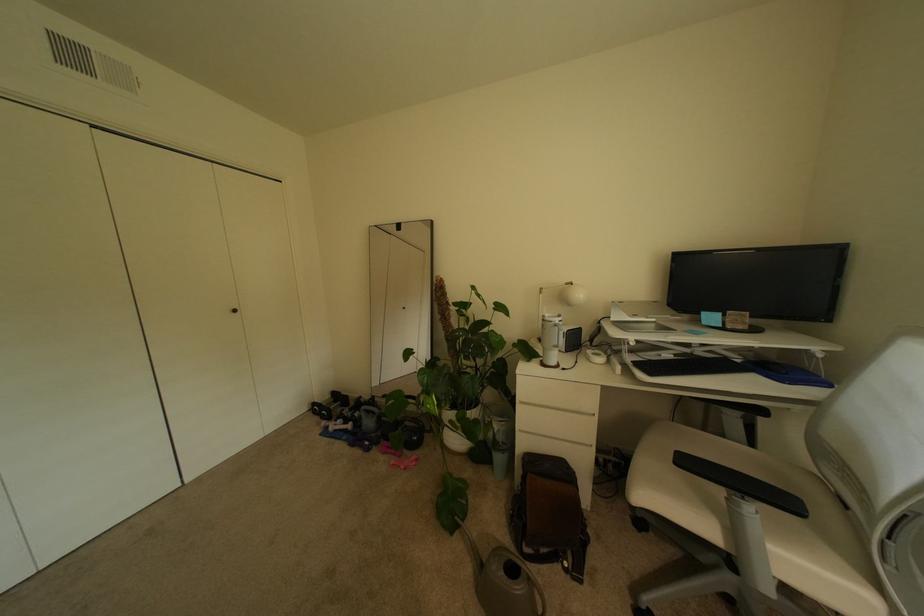
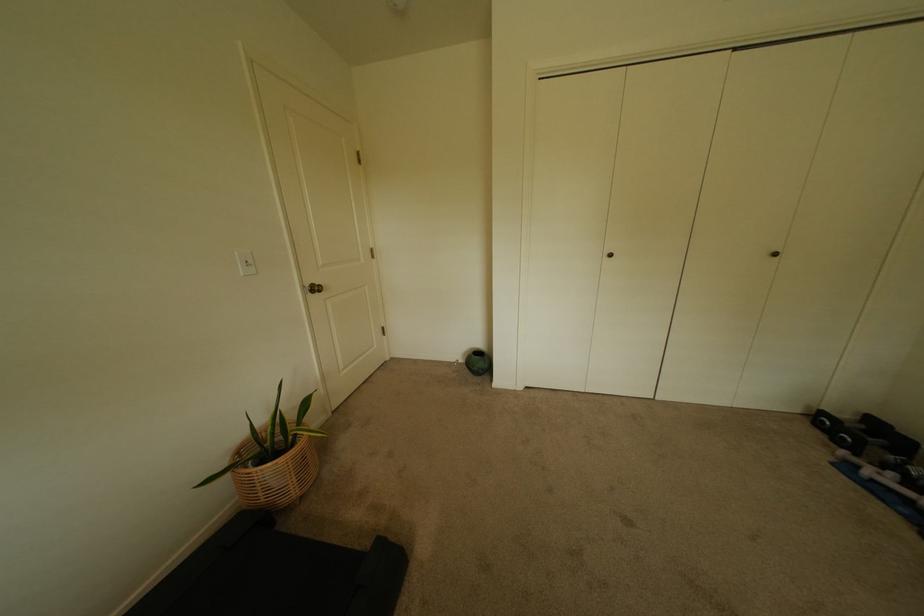
The point at (322,405) is marked in the first image. Where is the corresponding point in the second image?

(831, 415)